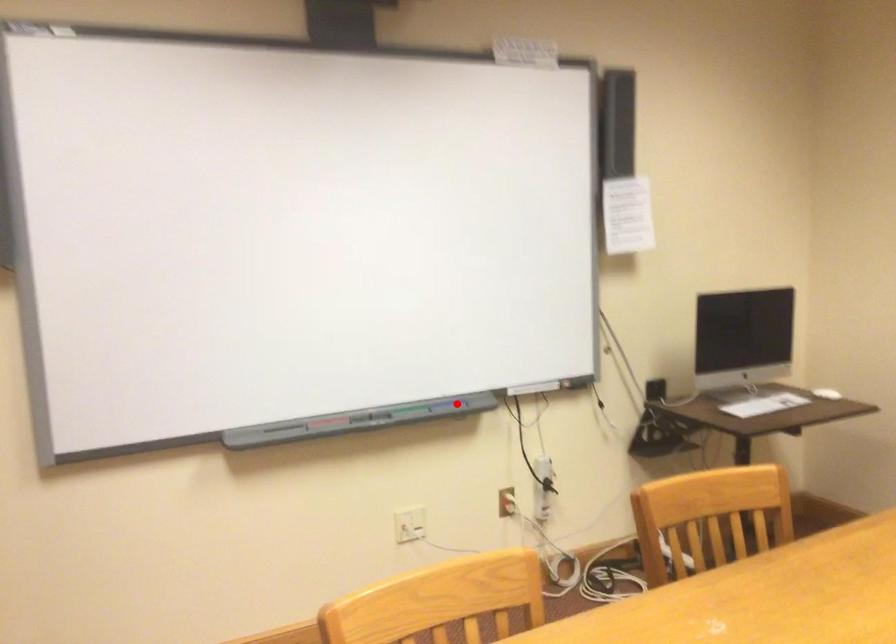
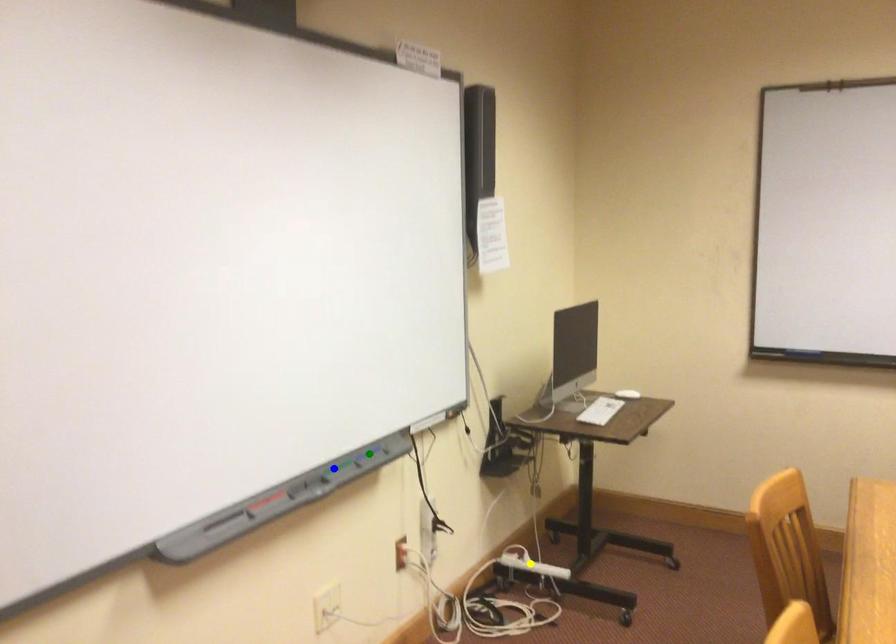
Question: I am providing you with two images of the same scene from different viewpoints. A red point is marked on the first image. You are given multiple points on the second image. Which spot in image 2 lines up with the point in image 1?

Choices:
 (A) blue point
 (B) green point
 (C) yellow point

Answer: (B)